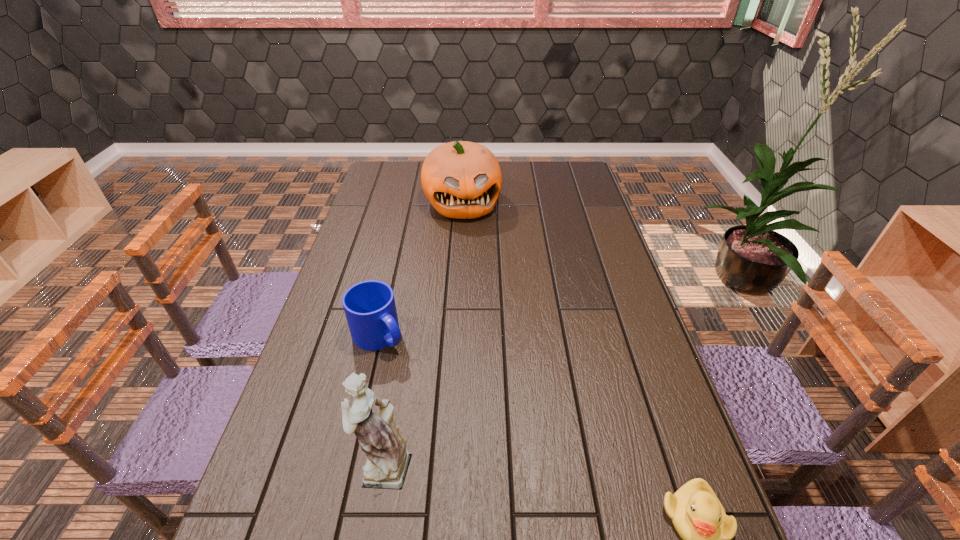
Locate an element on the screen. Image resolution: width=960 pixels, height=540 pixels. vacant space at the far left corner is located at coordinates click(x=381, y=177).

In the image, there is a desktop. Identify the location of vacant space at the far right corner. (585, 178).

You are a GUI agent. You are given a task and a screenshot of the screen. Output one action in this format:
    pyautogui.click(x=<x>, y=<y>)
    Task: Click on the free point between the farthest object and the figurine
    
    Given the screenshot: What is the action you would take?
    pyautogui.click(x=422, y=334)

This screenshot has width=960, height=540. Identify the location of empty space that is in between the tallest object and the farthest object. (422, 334).

Identify the location of free space between the mug and the pumpkin. The width and height of the screenshot is (960, 540). (420, 269).

The width and height of the screenshot is (960, 540). Identify the location of free point between the figurine and the pumpkin. (422, 334).

Where is `free spot between the second tallest object and the figurine`? free spot between the second tallest object and the figurine is located at coordinates (422, 334).

Find the location of a particular element. The image size is (960, 540). vacant space that's between the pumpkin and the figurine is located at coordinates (422, 334).

Find the location of a particular element. The height and width of the screenshot is (540, 960). free space between the figurine and the farthest object is located at coordinates (422, 334).

You are a GUI agent. You are given a task and a screenshot of the screen. Output one action in this format:
    pyautogui.click(x=<x>, y=<y>)
    Task: Click on the object that is the second closest to the figurine
    
    Given the screenshot: What is the action you would take?
    pyautogui.click(x=698, y=516)